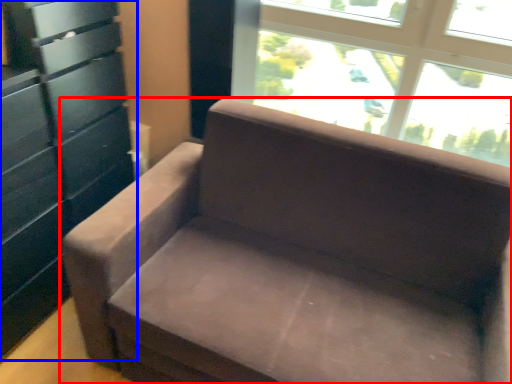
Question: Which point is further to the camera, studio couch (highlighted by a red box) or dresser (highlighted by a blue box)?

Choices:
 (A) studio couch
 (B) dresser

Answer: (B)